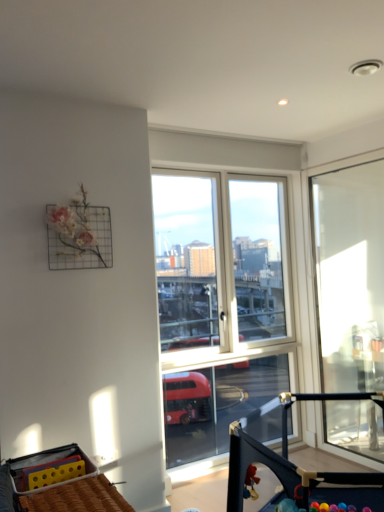
Question: Considering the relative positions of black plastic baby carriage at center, the 2th baby carriage when ordered from left to right, and yellow plastic baby carriage at lower left, arranged as the first baby carriage when viewed from the left, in the image provided, is black plastic baby carriage at center, the 2th baby carriage when ordered from left to right, behind yellow plastic baby carriage at lower left, arranged as the first baby carriage when viewed from the left,?

Choices:
 (A) yes
 (B) no

Answer: (B)

Question: From the image's perspective, would you say black plastic baby carriage at center, arranged as the 1th baby carriage when viewed from the right, is positioned over yellow plastic baby carriage at lower left, arranged as the first baby carriage when viewed from the left?

Choices:
 (A) yes
 (B) no

Answer: (B)

Question: Is black plastic baby carriage at center, arranged as the 1th baby carriage when viewed from the right, not inside yellow plastic baby carriage at lower left, arranged as the first baby carriage when viewed from the left?

Choices:
 (A) yes
 (B) no

Answer: (A)

Question: Is black plastic baby carriage at center, the 2th baby carriage when ordered from left to right, to the right of yellow plastic baby carriage at lower left, which is counted as the second baby carriage, starting from the right, from the viewer's perspective?

Choices:
 (A) no
 (B) yes

Answer: (B)

Question: Is black plastic baby carriage at center, arranged as the 1th baby carriage when viewed from the right, aimed at yellow plastic baby carriage at lower left, which is counted as the second baby carriage, starting from the right?

Choices:
 (A) yes
 (B) no

Answer: (B)

Question: Considering the relative sizes of black plastic baby carriage at center, the 2th baby carriage when ordered from left to right, and yellow plastic baby carriage at lower left, which is counted as the second baby carriage, starting from the right, in the image provided, is black plastic baby carriage at center, the 2th baby carriage when ordered from left to right, thinner than yellow plastic baby carriage at lower left, which is counted as the second baby carriage, starting from the right,?

Choices:
 (A) no
 (B) yes

Answer: (A)

Question: Is yellow plastic baby carriage at lower left, arranged as the first baby carriage when viewed from the left, smaller than black plastic baby carriage at center, arranged as the 1th baby carriage when viewed from the right?

Choices:
 (A) no
 (B) yes

Answer: (B)

Question: Is yellow plastic baby carriage at lower left, which is counted as the second baby carriage, starting from the right, thinner than black plastic baby carriage at center, arranged as the 1th baby carriage when viewed from the right?

Choices:
 (A) yes
 (B) no

Answer: (A)

Question: Is there a large distance between yellow plastic baby carriage at lower left, arranged as the first baby carriage when viewed from the left, and black plastic baby carriage at center, the 2th baby carriage when ordered from left to right?

Choices:
 (A) yes
 (B) no

Answer: (B)

Question: Considering the relative sizes of yellow plastic baby carriage at lower left, which is counted as the second baby carriage, starting from the right, and black plastic baby carriage at center, the 2th baby carriage when ordered from left to right, in the image provided, is yellow plastic baby carriage at lower left, which is counted as the second baby carriage, starting from the right, shorter than black plastic baby carriage at center, the 2th baby carriage when ordered from left to right,?

Choices:
 (A) no
 (B) yes

Answer: (B)

Question: From a real-world perspective, is yellow plastic baby carriage at lower left, arranged as the first baby carriage when viewed from the left, physically below black plastic baby carriage at center, arranged as the 1th baby carriage when viewed from the right?

Choices:
 (A) no
 (B) yes

Answer: (A)

Question: From the image's perspective, is yellow plastic baby carriage at lower left, arranged as the first baby carriage when viewed from the left, over black plastic baby carriage at center, arranged as the 1th baby carriage when viewed from the right?

Choices:
 (A) yes
 (B) no

Answer: (A)

Question: Is black plastic baby carriage at center, the 2th baby carriage when ordered from left to right, shorter than transparent glass door at right?

Choices:
 (A) yes
 (B) no

Answer: (A)